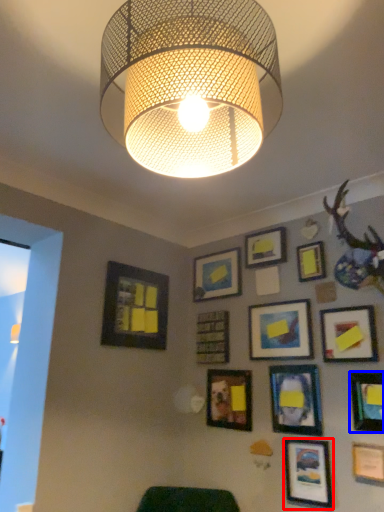
Question: Which of the following is the farthest to the observer, picture frame (highlighted by a red box) or picture frame (highlighted by a blue box)?

Choices:
 (A) picture frame
 (B) picture frame

Answer: (A)